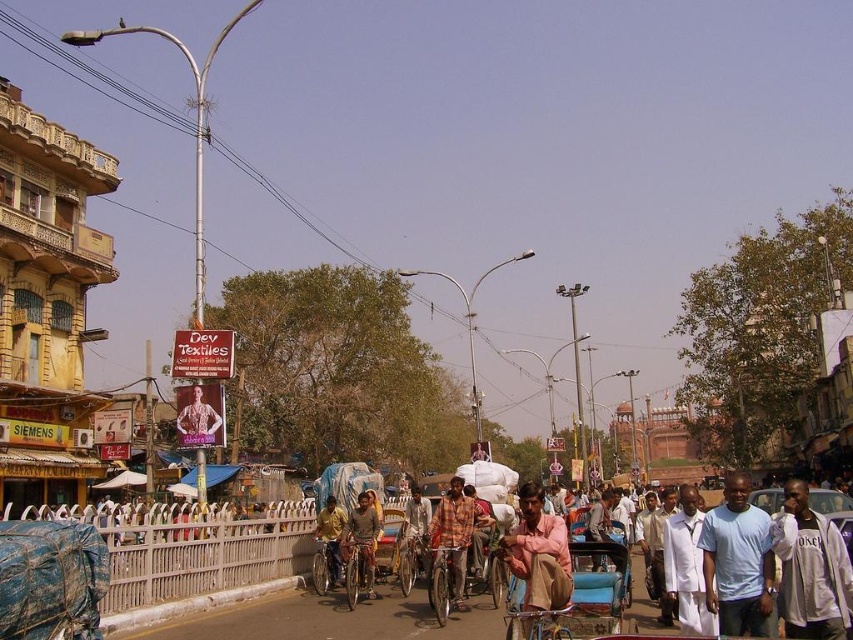
Question: Among these objects, which one is farthest from the camera?

Choices:
 (A) wooden cart at center
 (B) brown textured fabric at center

Answer: (B)

Question: Does white cotton shirt at center appear on the right side of light brown fabric shirt at center?

Choices:
 (A) yes
 (B) no

Answer: (A)

Question: Which of the following is the farthest from the observer?

Choices:
 (A) metallic silver car at center
 (B) light blue t-shirt at center

Answer: (A)

Question: Can you confirm if white cloth at center is positioned above light brown fabric shirt at center?

Choices:
 (A) no
 (B) yes

Answer: (B)

Question: Can you confirm if white cotton shirt at center is smaller than rustic wooden bicycle at center?

Choices:
 (A) yes
 (B) no

Answer: (B)

Question: Which object is the closest to the light pink cotton shirt at center?

Choices:
 (A) brown textured shirt at center
 (B) white cloth at center
 (C) light pink fabric at center

Answer: (C)